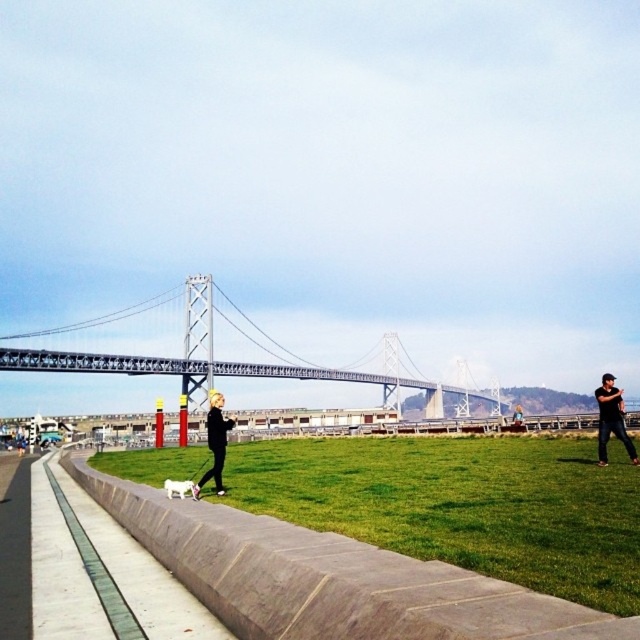
You are planning to set up a picnic area in the image. The green grass at lower center and the white fur dog at center are both in the foreground. Which area would be more suitable for placing a picnic blanket, and why?

The green grass at lower center is more suitable for placing a picnic blanket because it has a larger size compared to the white fur dog at center, providing enough space for the blanket.

You are a photographer trying to capture the Bay Bridge in the background. You notice the green grass at lower center and the white fur dog at center. Which object is closer to the camera, based on their sizes?

The green grass at lower center is taller than the white fur dog at center, so even though the dog might be closer, the grass appears larger in the frame. However, since the grass is at lower center and the dog is at center, the dog is likely closer to the camera.

You are planning to set up a small picnic area in the image. Given that the green grass at lower center is wider than the white fur dog at center, which area would be more suitable for placing a picnic blanket? Please explain your reasoning based on the spatial relationship between the two objects.

The green grass at lower center is wider than the white fur dog at center, making it a more suitable area for placing a picnic blanket since it provides a larger space.